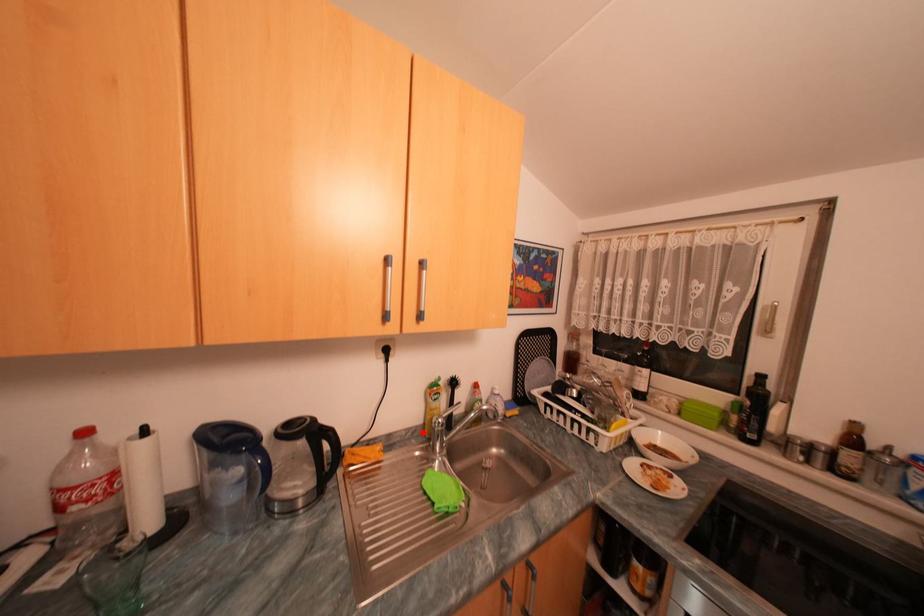
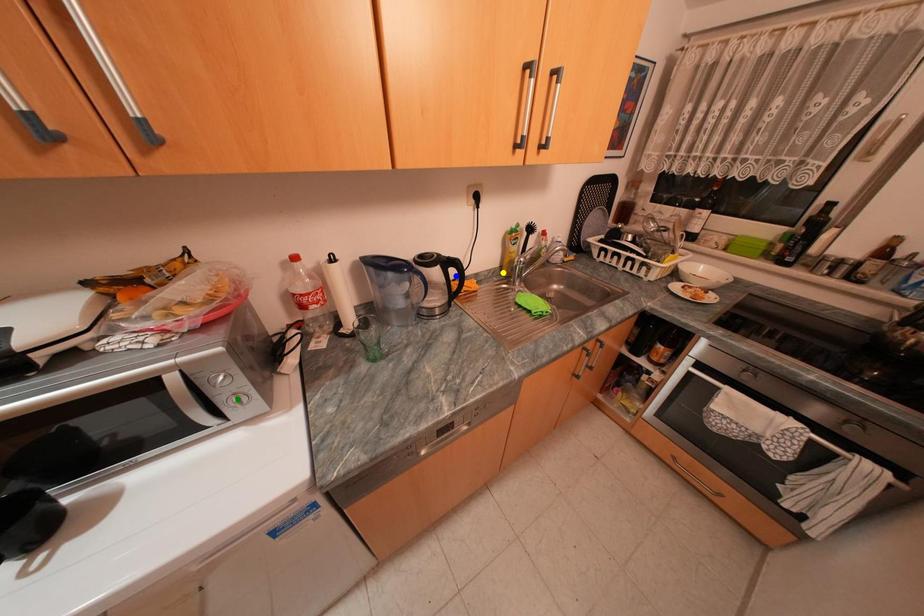
Question: I am providing you with two images of the same scene from different viewpoints. A red point is marked on the first image. You are given multiple points on the second image. In image 2, which mark is for the same physical point as the one in image 1?

Choices:
 (A) green point
 (B) blue point
 (C) yellow point

Answer: (C)